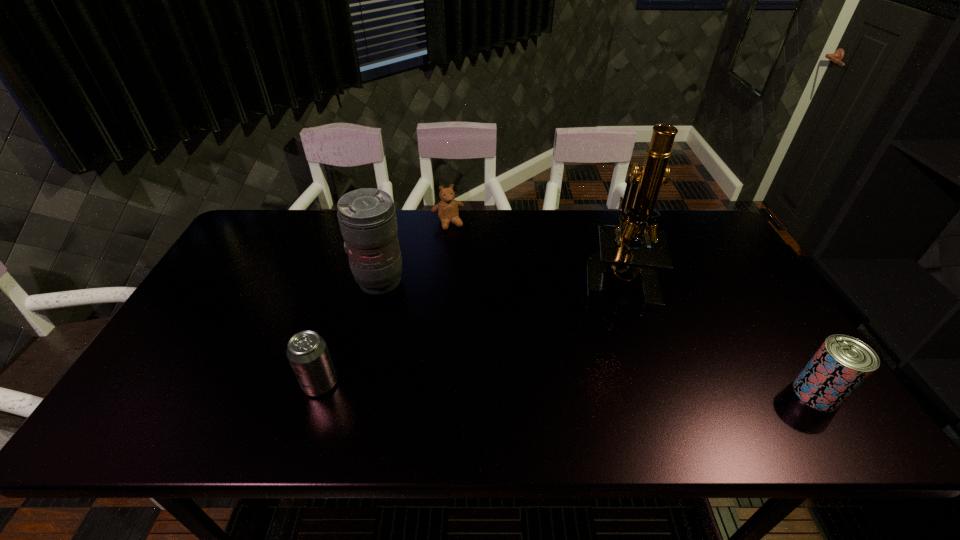
Image resolution: width=960 pixels, height=540 pixels. What are the coordinates of `vacant space on the desktop that is between the left beer can and the right beer can and is positioned at the eyepiece of the tallest object` in the screenshot? It's located at (546, 388).

Identify the location of vacant space on the desktop that is between the left beer can and the rightmost object and is positioned on the side of the second tallest object where the control switches are located. The height and width of the screenshot is (540, 960). (507, 388).

Locate an element on the screen. Image resolution: width=960 pixels, height=540 pixels. free spot on the desktop that is between the left beer can and the rightmost object and is positioned on the face of the farthest object is located at coordinates (529, 388).